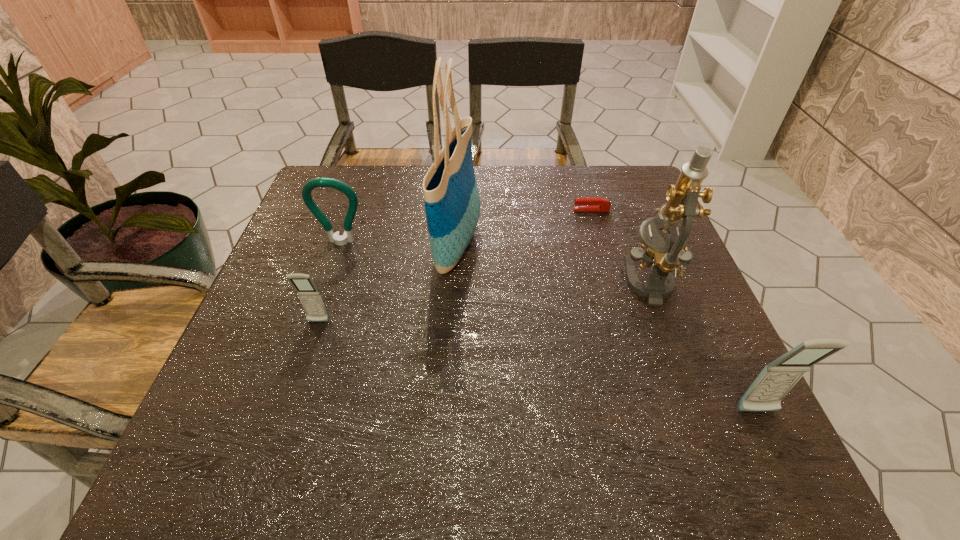
Identify the location of the shorter cellular telephone. Image resolution: width=960 pixels, height=540 pixels. (310, 297).

Identify the location of the fifth tallest object. (310, 297).

Identify the location of the nearest object. (765, 394).

This screenshot has width=960, height=540. In order to click on the nearer cellular telephone in this screenshot , I will do `click(765, 394)`.

Where is `stapler`? The image size is (960, 540). stapler is located at coordinates (589, 203).

What are the coordinates of `bottle opener` in the screenshot? It's located at (338, 239).

The height and width of the screenshot is (540, 960). I want to click on the tallest object, so click(x=451, y=196).

Where is `tote bag`? tote bag is located at coordinates (451, 196).

You are a GUI agent. You are given a task and a screenshot of the screen. Output one action in this format:
    pyautogui.click(x=<x>, y=<y>)
    Task: Click on the microscope
    
    Given the screenshot: What is the action you would take?
    pyautogui.click(x=668, y=253)

Identify the location of free space located on the front-facing side of the farther cellular telephone. (300, 376).